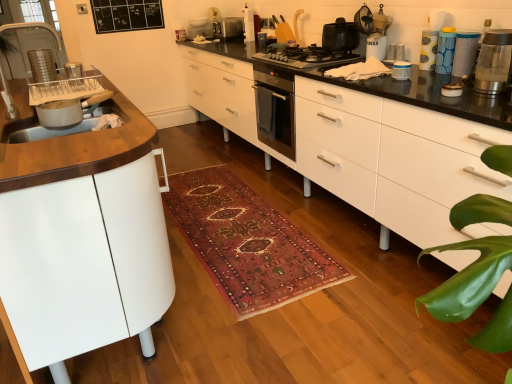
Question: Is white glossy chest of drawers at center to the right of yellow paper towel dispenser at upper right, the fourth appliance in the bottom-to-top sequence, from the viewer's perspective?

Choices:
 (A) yes
 (B) no

Answer: (B)

Question: Does white glossy chest of drawers at center appear on the left side of yellow paper towel dispenser at upper right, the 4th appliance when ordered from left to right?

Choices:
 (A) yes
 (B) no

Answer: (A)

Question: Are white glossy chest of drawers at center and yellow paper towel dispenser at upper right, the fourth appliance in the bottom-to-top sequence, beside each other?

Choices:
 (A) yes
 (B) no

Answer: (B)

Question: Is the depth of white glossy chest of drawers at center greater than that of yellow paper towel dispenser at upper right, marked as the third appliance in a top-to-bottom arrangement?

Choices:
 (A) yes
 (B) no

Answer: (B)

Question: From a real-world perspective, does white glossy chest of drawers at center stand above yellow paper towel dispenser at upper right, arranged as the third appliance when viewed from the right?

Choices:
 (A) no
 (B) yes

Answer: (A)

Question: Considering the positions of matte white sink at left and white glossy toaster at upper center, the first appliance from the top, in the image, is matte white sink at left taller or shorter than white glossy toaster at upper center, the first appliance from the top,?

Choices:
 (A) short
 (B) tall

Answer: (A)

Question: From a real-world perspective, is matte white sink at left positioned above or below white glossy toaster at upper center, the first appliance from the top?

Choices:
 (A) above
 (B) below

Answer: (B)

Question: In terms of width, does matte white sink at left look wider or thinner when compared to white glossy toaster at upper center, the first appliance from the top?

Choices:
 (A) wide
 (B) thin

Answer: (A)

Question: Does point (48, 130) appear closer or farther from the camera than point (248, 11)?

Choices:
 (A) farther
 (B) closer

Answer: (B)

Question: Is matte plastic container at upper right, arranged as the 2th appliance when ordered from the bottom, in front of or behind matte white sink at left in the image?

Choices:
 (A) front
 (B) behind

Answer: (B)

Question: Is matte plastic container at upper right, which appears as the sixth appliance when viewed from the left, wider or thinner than matte white sink at left?

Choices:
 (A) thin
 (B) wide

Answer: (A)

Question: Is point (463, 59) positioned closer to the camera than point (54, 129)?

Choices:
 (A) closer
 (B) farther

Answer: (B)

Question: From the image's perspective, is matte plastic container at upper right, the 5th appliance viewed from the top, positioned above or below matte white sink at left?

Choices:
 (A) below
 (B) above

Answer: (B)

Question: In terms of width, does blue textured canister at upper right, which is counted as the fifth appliance, starting from the left, look wider or thinner when compared to black matte gas stove at center?

Choices:
 (A) wide
 (B) thin

Answer: (B)

Question: Based on their sizes in the image, would you say blue textured canister at upper right, marked as the fourth appliance in a top-to-bottom arrangement, is bigger or smaller than black matte gas stove at center?

Choices:
 (A) big
 (B) small

Answer: (B)